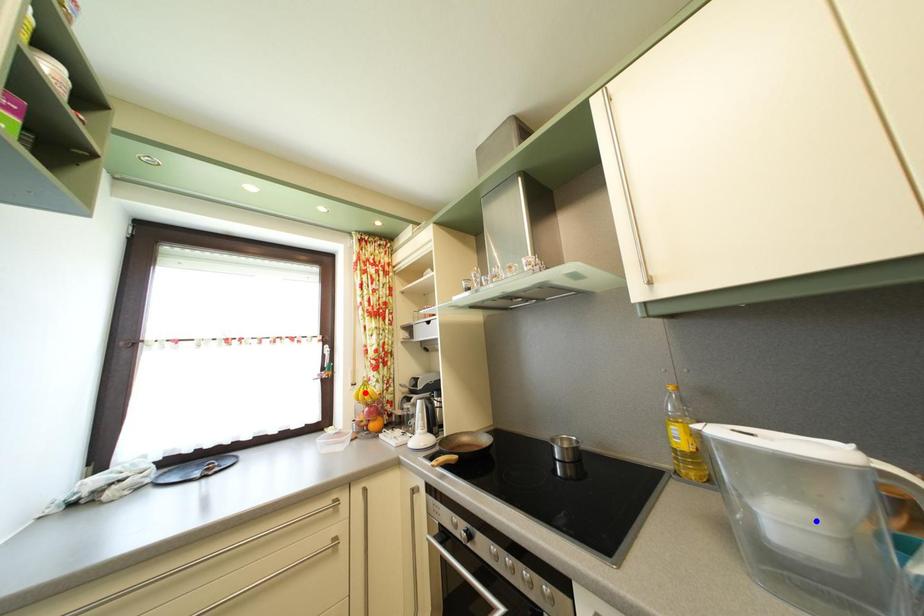
Question: Two points are marked on the image. Which point is closer to the camera?

Choices:
 (A) Blue point is closer.
 (B) Red point is closer.

Answer: (A)